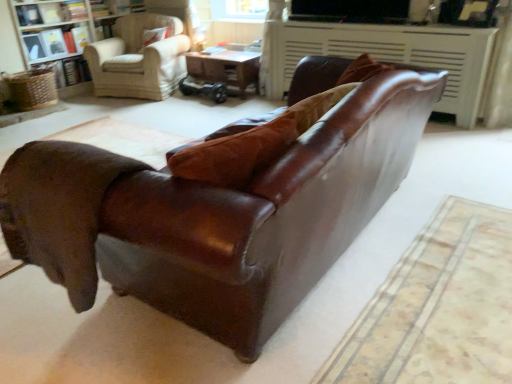
Question: Is white textured bookcase at upper left to the left of wooden table at center from the viewer's perspective?

Choices:
 (A) yes
 (B) no

Answer: (A)

Question: Could wooden table at center be considered to be inside white textured bookcase at upper left?

Choices:
 (A) no
 (B) yes

Answer: (A)

Question: Is white textured bookcase at upper left thinner than wooden table at center?

Choices:
 (A) no
 (B) yes

Answer: (A)

Question: Considering the relative sizes of white textured bookcase at upper left and wooden table at center in the image provided, is white textured bookcase at upper left taller than wooden table at center?

Choices:
 (A) yes
 (B) no

Answer: (A)

Question: From a real-world perspective, is white textured bookcase at upper left on top of wooden table at center?

Choices:
 (A) no
 (B) yes

Answer: (B)

Question: Is wooden table at center situated inside brown leather fireplace at upper center or outside?

Choices:
 (A) outside
 (B) inside

Answer: (A)

Question: Is point (225, 66) closer or farther from the camera than point (458, 74)?

Choices:
 (A) closer
 (B) farther

Answer: (B)

Question: Considering the positions of wooden table at center and brown leather fireplace at upper center in the image, is wooden table at center wider or thinner than brown leather fireplace at upper center?

Choices:
 (A) wide
 (B) thin

Answer: (B)

Question: From a real-world perspective, is wooden table at center physically located above or below brown leather fireplace at upper center?

Choices:
 (A) below
 (B) above

Answer: (A)

Question: Considering their positions, is shiny brown leather couch at center located in front of or behind wooden table at center?

Choices:
 (A) front
 (B) behind

Answer: (A)

Question: Is shiny brown leather couch at center to the left or to the right of wooden table at center in the image?

Choices:
 (A) left
 (B) right

Answer: (B)

Question: From the image's perspective, is shiny brown leather couch at center above or below wooden table at center?

Choices:
 (A) above
 (B) below

Answer: (B)

Question: Is shiny brown leather couch at center bigger or smaller than wooden table at center?

Choices:
 (A) big
 (B) small

Answer: (A)

Question: In terms of size, does brown leather fireplace at upper center appear bigger or smaller than light beige fabric armchair at upper left?

Choices:
 (A) small
 (B) big

Answer: (A)

Question: In terms of height, does brown leather fireplace at upper center look taller or shorter compared to light beige fabric armchair at upper left?

Choices:
 (A) tall
 (B) short

Answer: (B)